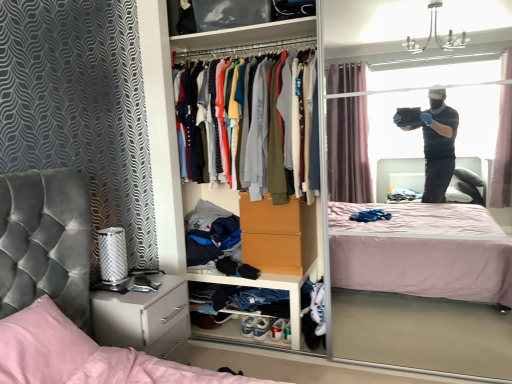
Question: Is pink satin pillow at lower left closer to camera compared to white glossy nightstand at lower left?

Choices:
 (A) no
 (B) yes

Answer: (B)

Question: Does pink satin pillow at lower left have a smaller size compared to white glossy nightstand at lower left?

Choices:
 (A) no
 (B) yes

Answer: (B)

Question: From the image's perspective, would you say pink satin pillow at lower left is positioned over white glossy nightstand at lower left?

Choices:
 (A) yes
 (B) no

Answer: (A)

Question: From a real-world perspective, does pink satin pillow at lower left sit lower than white glossy nightstand at lower left?

Choices:
 (A) no
 (B) yes

Answer: (A)

Question: Is pink satin pillow at lower left with white glossy nightstand at lower left?

Choices:
 (A) yes
 (B) no

Answer: (B)

Question: In terms of height, does white leather sneakers at lower center, marked as the first footwear in a right-to-left arrangement, look taller or shorter compared to white matte cabinet at lower center?

Choices:
 (A) short
 (B) tall

Answer: (A)

Question: From the image's perspective, is white leather sneakers at lower center, placed as the second footwear when sorted from left to right, above or below white matte cabinet at lower center?

Choices:
 (A) above
 (B) below

Answer: (B)

Question: From a real-world perspective, is white leather sneakers at lower center, placed as the second footwear when sorted from left to right, above or below white matte cabinet at lower center?

Choices:
 (A) below
 (B) above

Answer: (A)

Question: Considering their positions, is white leather sneakers at lower center, placed as the second footwear when sorted from left to right, located in front of or behind white matte cabinet at lower center?

Choices:
 (A) behind
 (B) front

Answer: (A)

Question: Would you say pink satin pillow at lower left is to the left or to the right of white matte cabinet at lower center in the picture?

Choices:
 (A) left
 (B) right

Answer: (A)

Question: Is pink satin pillow at lower left in front of or behind white matte cabinet at lower center in the image?

Choices:
 (A) front
 (B) behind

Answer: (A)

Question: Is point (44, 354) positioned closer to the camera than point (311, 269)?

Choices:
 (A) closer
 (B) farther

Answer: (A)

Question: Considering the positions of pink satin pillow at lower left and white matte cabinet at lower center in the image, is pink satin pillow at lower left taller or shorter than white matte cabinet at lower center?

Choices:
 (A) short
 (B) tall

Answer: (A)

Question: From the image's perspective, is white leather sneakers at lower center, placed as the second footwear when sorted from left to right, above or below white leather sneakers at lower center, positioned as the 2th footwear in right-to-left order?

Choices:
 (A) above
 (B) below

Answer: (A)

Question: Is white leather sneakers at lower center, marked as the first footwear in a right-to-left arrangement, taller or shorter than white leather sneakers at lower center, arranged as the 1th footwear when viewed from the left?

Choices:
 (A) tall
 (B) short

Answer: (B)